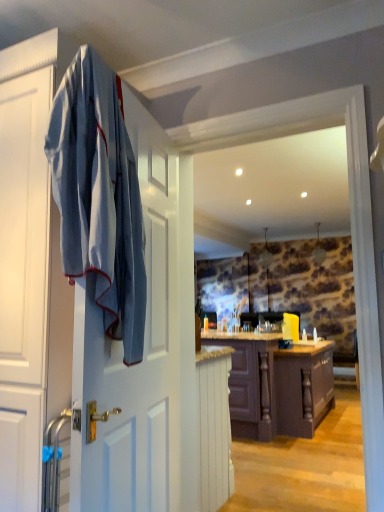
Question: From a real-world perspective, does white painted wood cabinet at lower center, arranged as the 2th cabinetry when viewed from the back, sit lower than dark wood cabinet at center, marked as the 2th cabinetry in a front-to-back arrangement?

Choices:
 (A) no
 (B) yes

Answer: (B)

Question: Is white painted wood cabinet at lower center, arranged as the 2th cabinetry when viewed from the back, at the right side of dark wood cabinet at center, the 1th cabinetry in the back-to-front sequence?

Choices:
 (A) yes
 (B) no

Answer: (B)

Question: Does white painted wood cabinet at lower center, arranged as the 2th cabinetry when viewed from the right, lie in front of dark wood cabinet at center, the second cabinetry positioned from the left?

Choices:
 (A) yes
 (B) no

Answer: (A)

Question: Does white painted wood cabinet at lower center, the 1th cabinetry from the front, appear on the left side of dark wood cabinet at center, the 1th cabinetry in the back-to-front sequence?

Choices:
 (A) no
 (B) yes

Answer: (B)

Question: From the image's perspective, would you say white painted wood cabinet at lower center, the first cabinetry when ordered from left to right, is shown under dark wood cabinet at center, marked as the 2th cabinetry in a front-to-back arrangement?

Choices:
 (A) yes
 (B) no

Answer: (B)

Question: Does point (117, 229) appear closer or farther from the camera than point (266, 374)?

Choices:
 (A) closer
 (B) farther

Answer: (A)

Question: Considering the positions of blue cotton bath towel at left and dark wood cabinet at center, the 1th cabinetry when ordered from right to left, in the image, is blue cotton bath towel at left taller or shorter than dark wood cabinet at center, the 1th cabinetry when ordered from right to left,?

Choices:
 (A) tall
 (B) short

Answer: (A)

Question: Is blue cotton bath towel at left bigger or smaller than dark wood cabinet at center, the second cabinetry positioned from the left?

Choices:
 (A) big
 (B) small

Answer: (B)

Question: Which is correct: blue cotton bath towel at left is inside dark wood cabinet at center, the second cabinetry positioned from the left, or outside of it?

Choices:
 (A) outside
 (B) inside

Answer: (A)

Question: Is point (215, 443) closer or farther from the camera than point (309, 394)?

Choices:
 (A) farther
 (B) closer

Answer: (B)

Question: From their relative heights in the image, would you say white painted wood cabinet at lower center, the 1th cabinetry from the front, is taller or shorter than dark wood cabinet at center, the second cabinetry positioned from the left?

Choices:
 (A) tall
 (B) short

Answer: (B)

Question: Considering the relative positions of white painted wood cabinet at lower center, arranged as the 2th cabinetry when viewed from the right, and dark wood cabinet at center, the 1th cabinetry in the back-to-front sequence, in the image provided, is white painted wood cabinet at lower center, arranged as the 2th cabinetry when viewed from the right, to the left or to the right of dark wood cabinet at center, the 1th cabinetry in the back-to-front sequence,?

Choices:
 (A) left
 (B) right

Answer: (A)

Question: Considering their positions, is white painted wood cabinet at lower center, the 1th cabinetry from the front, located in front of or behind dark wood cabinet at center, marked as the 2th cabinetry in a front-to-back arrangement?

Choices:
 (A) front
 (B) behind

Answer: (A)

Question: In the image, is dark wood cabinet at center, the second cabinetry positioned from the left, positioned in front of or behind blue cotton bath towel at left?

Choices:
 (A) front
 (B) behind

Answer: (B)

Question: Would you say dark wood cabinet at center, the 1th cabinetry when ordered from right to left, is to the left or to the right of blue cotton bath towel at left in the picture?

Choices:
 (A) right
 (B) left

Answer: (A)